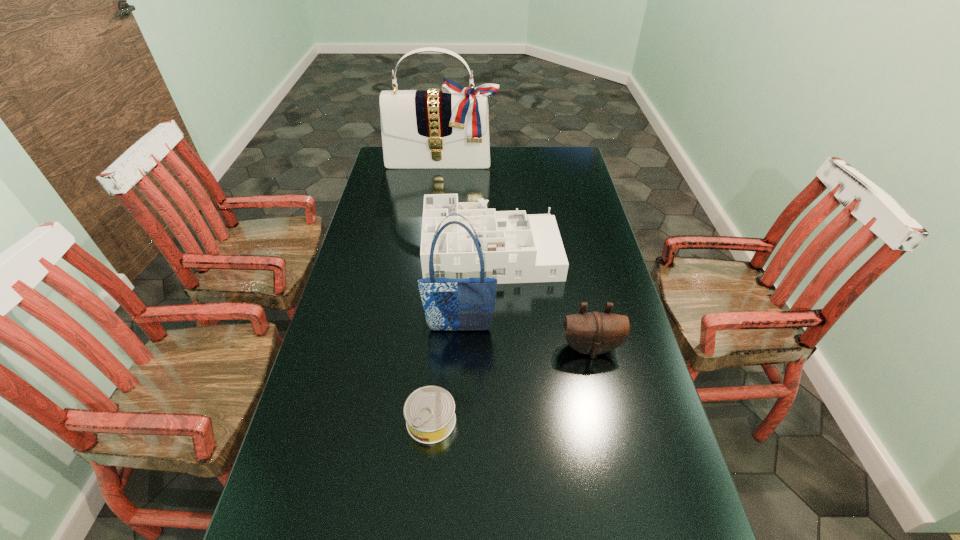
Where is `vacant space located 0.190m on the back of the dollhouse`? The width and height of the screenshot is (960, 540). vacant space located 0.190m on the back of the dollhouse is located at coordinates (490, 193).

In order to click on vacant space located 0.230m on the left of the shortest object in this screenshot , I will do `click(310, 421)`.

The image size is (960, 540). Identify the location of object that is at the far edge. (449, 128).

Identify the location of object present at the left edge. (449, 128).

Identify the location of object that is at the right edge. pyautogui.click(x=594, y=333).

Image resolution: width=960 pixels, height=540 pixels. What are the coordinates of `object at the far left corner` in the screenshot? It's located at (449, 128).

The width and height of the screenshot is (960, 540). In the image, there is a desktop. What are the coordinates of `free space at the far edge` in the screenshot? It's located at (540, 166).

Identify the location of vacant point at the left edge. (353, 430).

You are a GUI agent. You are given a task and a screenshot of the screen. Output one action in this format:
    pyautogui.click(x=<x>, y=<y>)
    Task: Click on the vacant space at the right edge of the desktop
    The width and height of the screenshot is (960, 540).
    Given the screenshot: What is the action you would take?
    pyautogui.click(x=613, y=368)

This screenshot has width=960, height=540. I want to click on vacant area that lies between the pouch and the second farthest object, so click(541, 299).